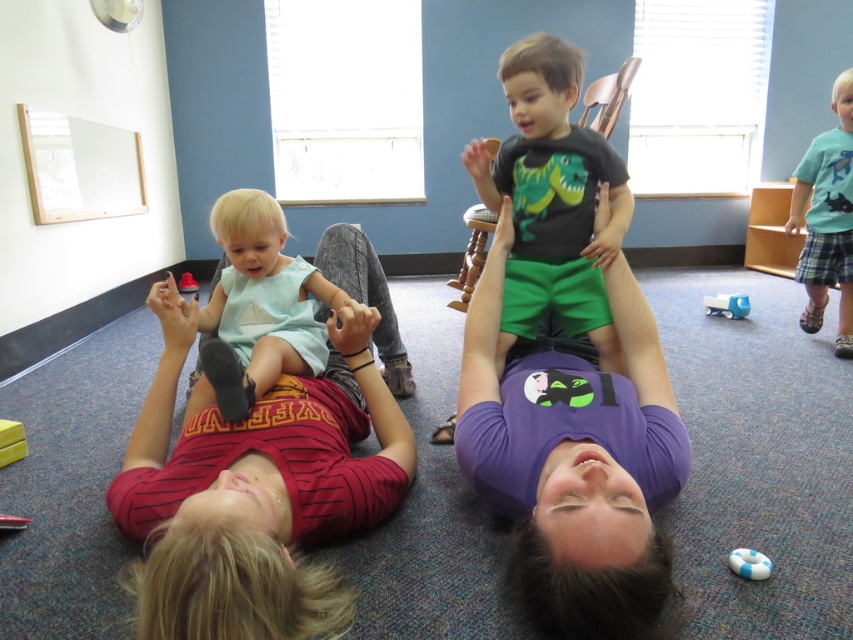
Is matte red shirt at upper left smaller than blue rubber ring at lower center?

Incorrect, matte red shirt at upper left is not smaller in size than blue rubber ring at lower center.

Does point (126, 449) come closer to viewer compared to point (737, 557)?

No, it is not.

What do you see at coordinates (254, 492) in the screenshot?
I see `matte red shirt at upper left` at bounding box center [254, 492].

Where is `matte red shirt at upper left`? matte red shirt at upper left is located at coordinates (254, 492).

Does light blue fabric baby at center have a larger size compared to blue plastic toy at center?

Correct, light blue fabric baby at center is larger in size than blue plastic toy at center.

Between light blue fabric baby at center and blue plastic toy at center, which one is positioned lower?

light blue fabric baby at center

Between point (219, 278) and point (730, 310), which one is positioned behind?

The point (730, 310) is more distant.

Locate an element on the screen. Image resolution: width=853 pixels, height=640 pixels. light blue fabric baby at center is located at coordinates (260, 305).

Does green cotton shorts at center have a greater width compared to blue plaid shorts at right?

Yes.

Identify the location of green cotton shorts at center. (552, 198).

This screenshot has width=853, height=640. Find the location of `green cotton shorts at center`. green cotton shorts at center is located at coordinates (552, 198).